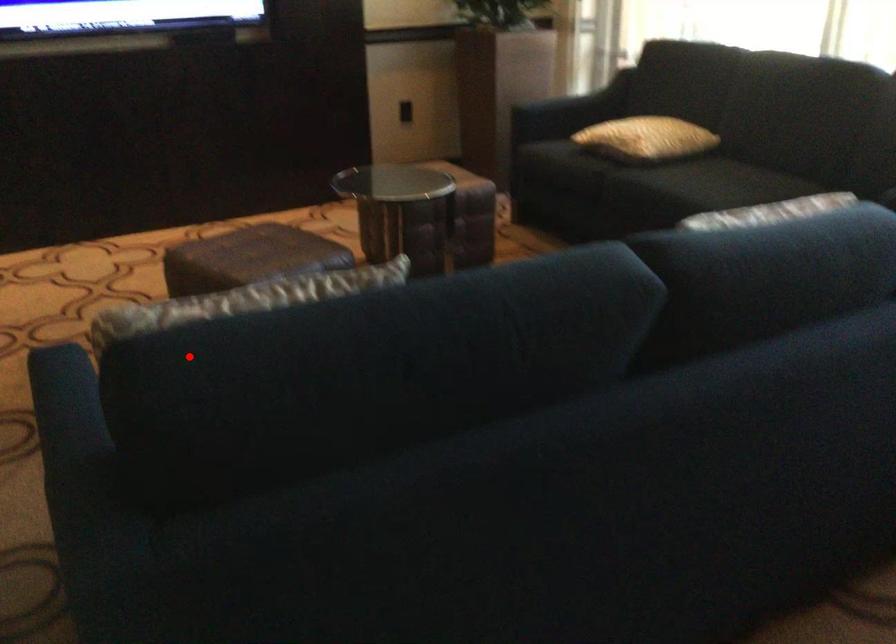
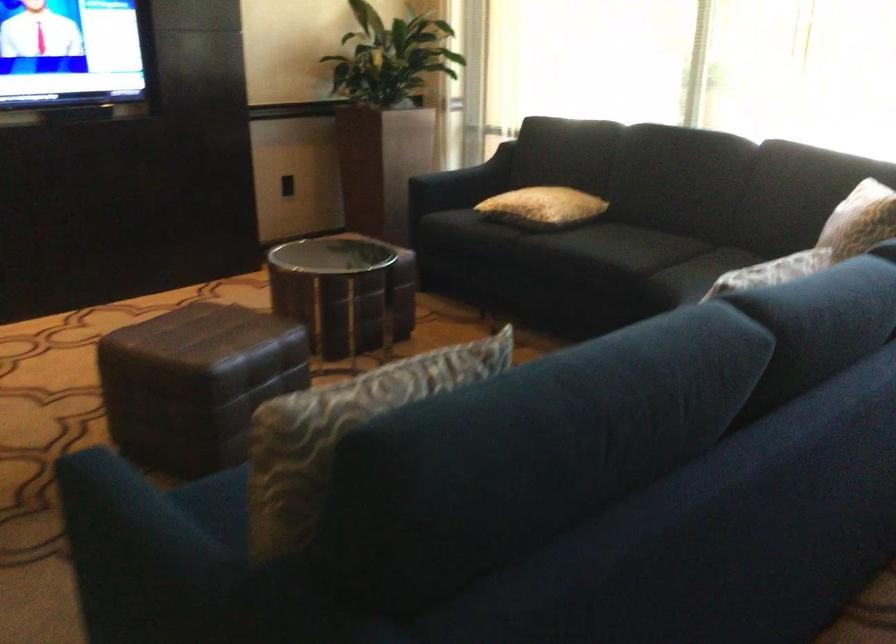
Where in the second image is the point corresponding to the highlighted location from the first image?

(340, 431)